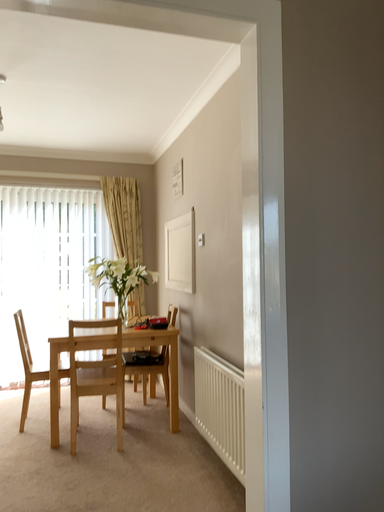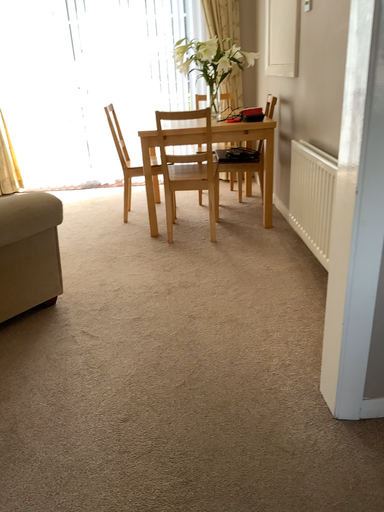
Question: Which way did the camera rotate in the video?

Choices:
 (A) rotated downward
 (B) rotated upward

Answer: (A)